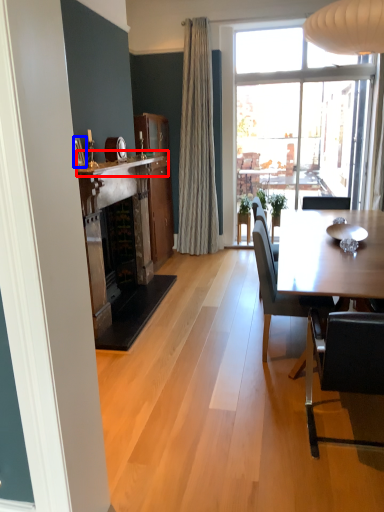
Question: Which point is closer to the camera, mantle (highlighted by a red box) or picture frame (highlighted by a blue box)?

Choices:
 (A) mantle
 (B) picture frame

Answer: (A)